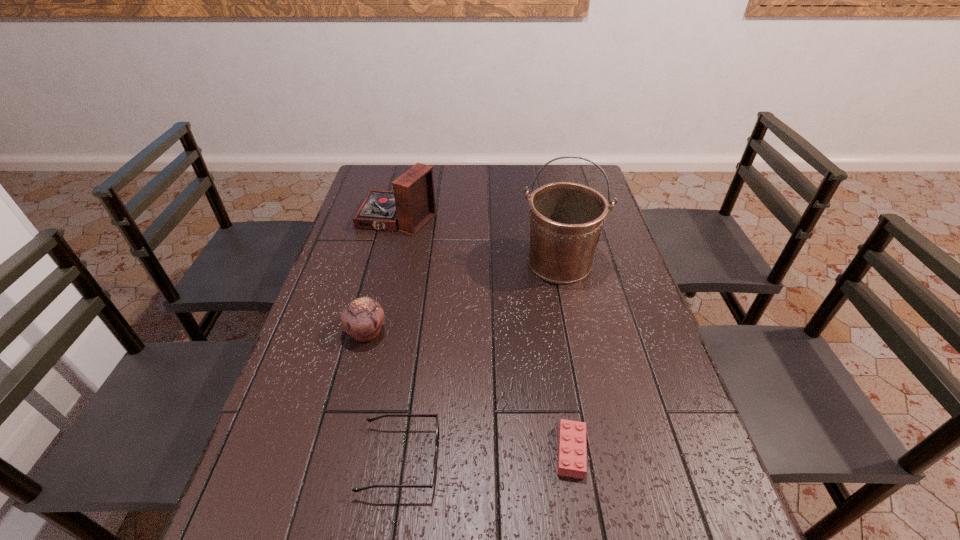
Image resolution: width=960 pixels, height=540 pixels. Identify the location of vacant space that satisfies the following two spatial constraints: 1. on the back side of the tallest object; 2. on the right side of the Lego. (541, 263).